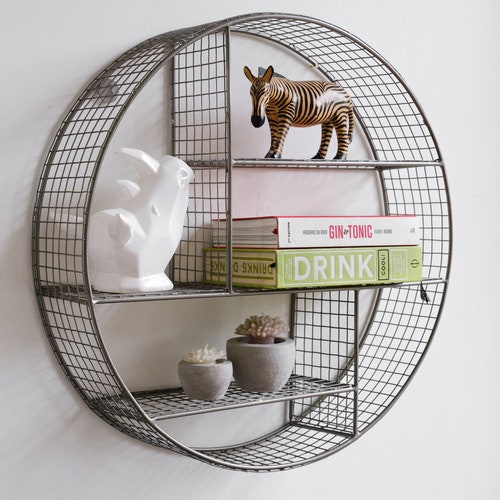
What are the coordinates of `small flower pot` in the screenshot? It's located at (204, 392).